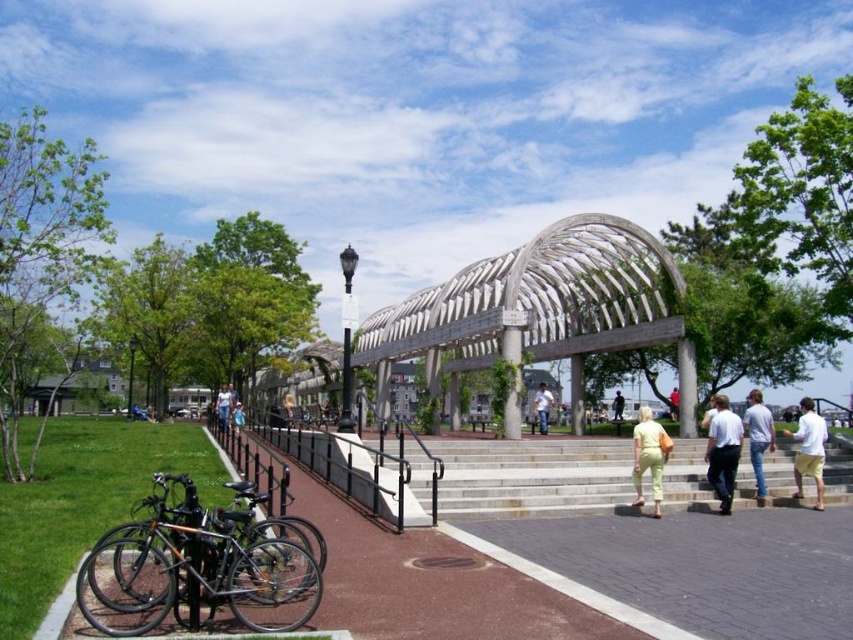
Question: Is light blue jeans at center smaller than light yellow pants at center?

Choices:
 (A) no
 (B) yes

Answer: (A)

Question: Among these points, which one is farthest from the camera?

Choices:
 (A) (595, 486)
 (B) (218, 420)

Answer: (B)

Question: Which point is closer to the camera?

Choices:
 (A) white cotton shirt at lower right
 (B) lime green jumpsuit at center
 (C) light gray concrete stairs at center

Answer: (C)

Question: Which of the following is the closest to the observer?

Choices:
 (A) white cotton shirt at lower right
 (B) light blue jeans at center
 (C) white cotton shirt at center
 (D) light brown wooden bench at center

Answer: (A)

Question: Considering the relative positions of shiny black bicycle at lower left and white cotton shirt at center in the image provided, where is shiny black bicycle at lower left located with respect to white cotton shirt at center?

Choices:
 (A) above
 (B) below

Answer: (B)

Question: Is white cotton shirt at center-right to the left of white cotton shirt at center from the viewer's perspective?

Choices:
 (A) yes
 (B) no

Answer: (B)